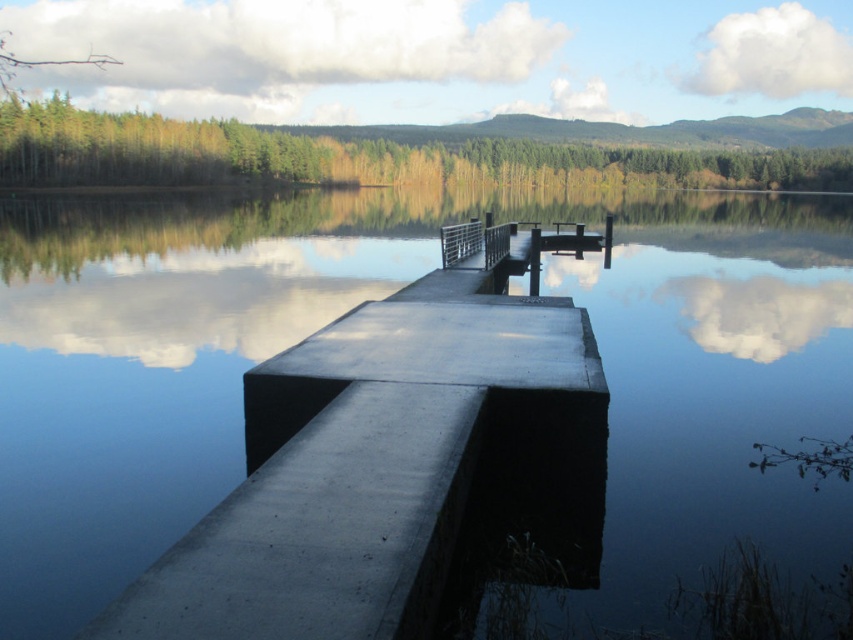
Can you confirm if smooth blue water at center is bigger than satin silver railing at center?

Yes, smooth blue water at center is bigger than satin silver railing at center.

Consider the image. Can you confirm if smooth blue water at center is taller than satin silver railing at center?

Indeed, smooth blue water at center has a greater height compared to satin silver railing at center.

This screenshot has width=853, height=640. What do you see at coordinates (376, 298) in the screenshot? I see `smooth blue water at center` at bounding box center [376, 298].

Find the location of a particular element. Image resolution: width=853 pixels, height=640 pixels. smooth blue water at center is located at coordinates (376, 298).